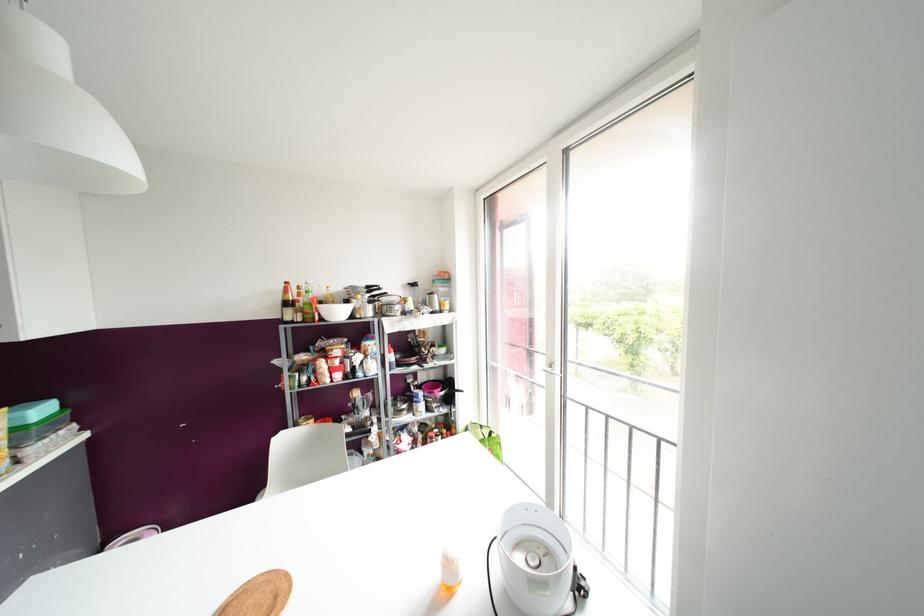
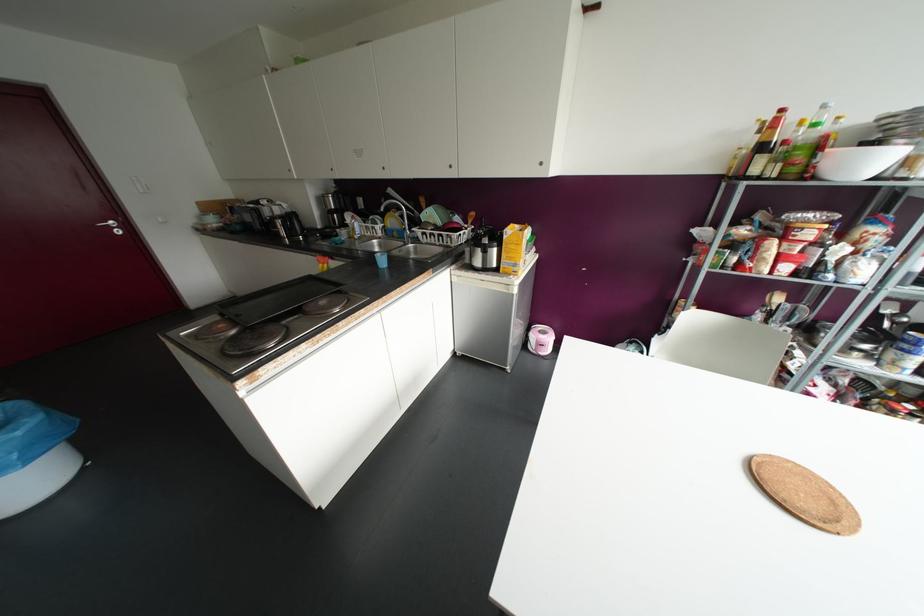
In the second image, find the point that corresponds to (286,282) in the first image.

(781, 110)